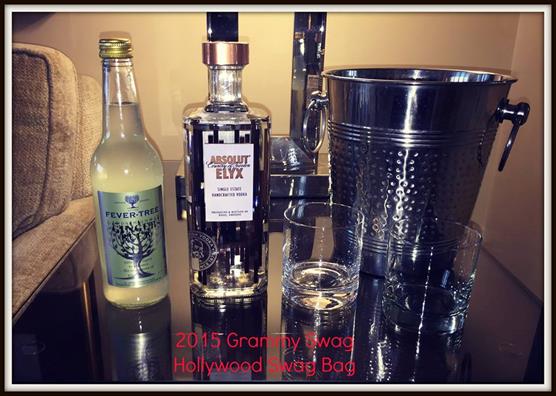
At what (x,y) coordinates should I click in order to perform the action: click on side table. Please return your answer as a coordinate pair (x, y). Image resolution: width=556 pixels, height=396 pixels. Looking at the image, I should click on (434, 366).